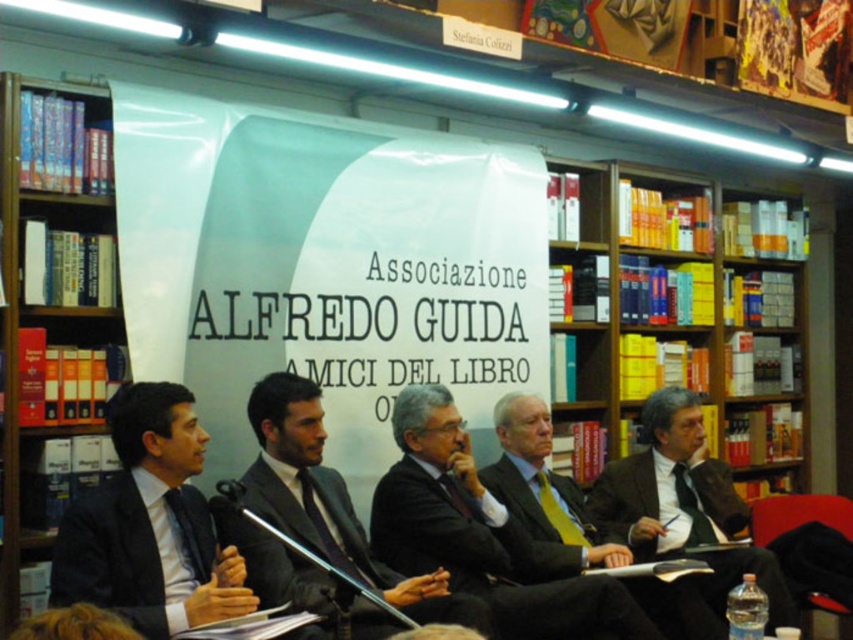
You are organizing a photo shoot for a magazine and need to ensure that the two central panelists in the image are positioned exactly 80 centimeters apart for the cover shot. Given that the black matte suit at center and the dark brown suit at center are currently 79.39 centimeters apart, will you need to adjust their positions?

The black matte suit at center is currently 79.39 centimeters from the dark brown suit at center. Since the desired distance is 80 centimeters, you will need to move them slightly apart by approximately 0.61 centimeters to meet the requirement.

In the scene of the panel discussion at the bookstore or library, there is a point marked at coordinates [492,557]. Which object from the list below is located at that point? Choose from the objects listed below. Objects available for selection are black matte suit at center, banner with the text

The point at coordinates [492,557] corresponds to the black matte suit at center.